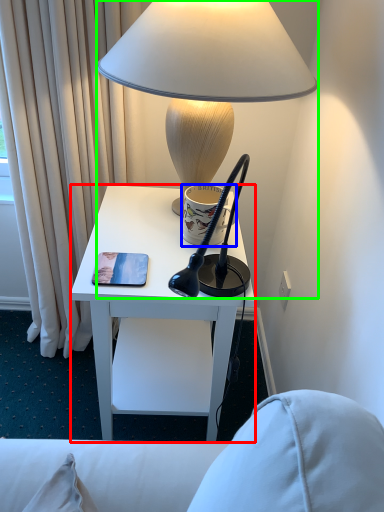
Question: Which object is the farthest from desk (highlighted by a red box)? Choose among these: coffee cup (highlighted by a blue box) or lamp (highlighted by a green box).

Choices:
 (A) coffee cup
 (B) lamp

Answer: (B)